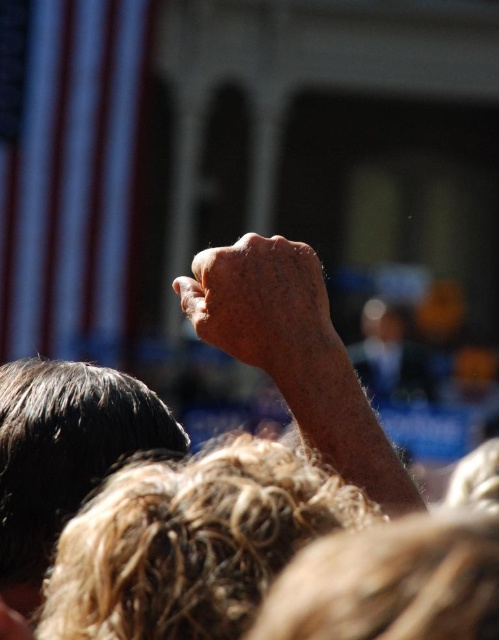
Question: Does dry skin at center appear on the right side of dark brown hair at upper left?

Choices:
 (A) yes
 (B) no

Answer: (A)

Question: Which point is closer to the camera?

Choices:
 (A) (256, 285)
 (B) (71, 394)

Answer: (A)

Question: Which object is farther from the camera taking this photo?

Choices:
 (A) dark brown hair at upper left
 (B) dry skin at center

Answer: (A)

Question: Is dark brown hair at upper left below dry skin hand at center?

Choices:
 (A) no
 (B) yes

Answer: (B)

Question: Considering the relative positions of dark brown hair at upper left and dry skin hand at center in the image provided, where is dark brown hair at upper left located with respect to dry skin hand at center?

Choices:
 (A) left
 (B) right

Answer: (A)

Question: Which point appears closest to the camera in this image?

Choices:
 (A) (118, 410)
 (B) (270, 294)
 (C) (212, 276)

Answer: (B)